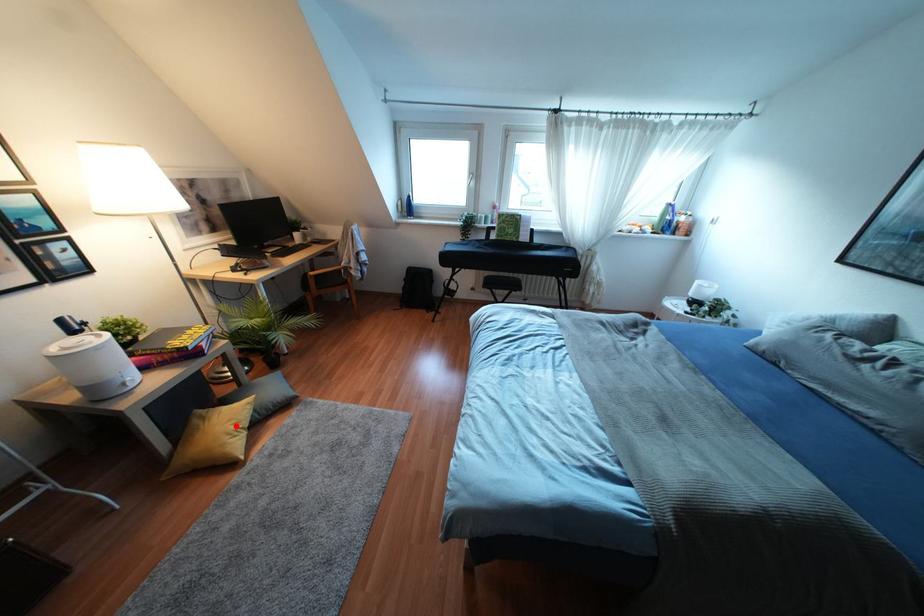
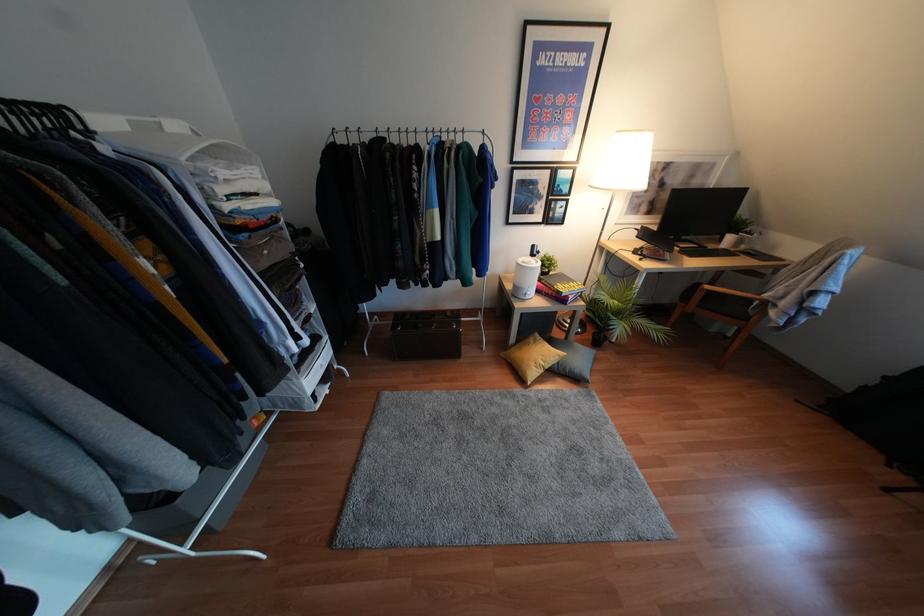
Find the pixel in the second image that matches the highlighted location in the first image.

(541, 363)